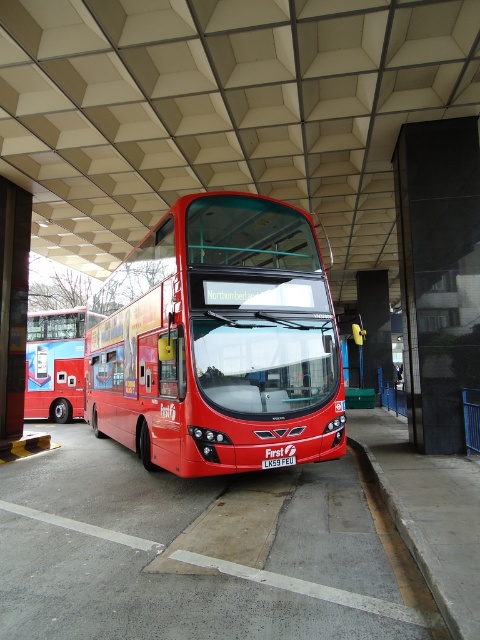
Question: Among these objects, which one is nearest to the camera?

Choices:
 (A) matte red bus at center
 (B) shiny red bus at center

Answer: (B)

Question: Is shiny red bus at center thinner than matte red bus at center?

Choices:
 (A) yes
 (B) no

Answer: (A)

Question: Is shiny red bus at center smaller than matte red bus at center?

Choices:
 (A) yes
 (B) no

Answer: (A)

Question: Does shiny red bus at center appear on the left side of matte red bus at center?

Choices:
 (A) yes
 (B) no

Answer: (B)